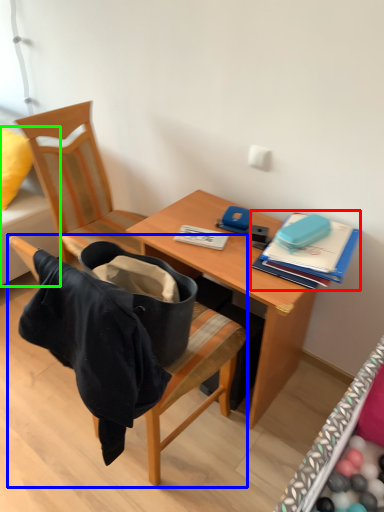
Question: Which object is positioned farthest from book (highlighted by a red box)? Select from chair (highlighted by a blue box) and studio couch (highlighted by a green box).

Choices:
 (A) chair
 (B) studio couch

Answer: (B)